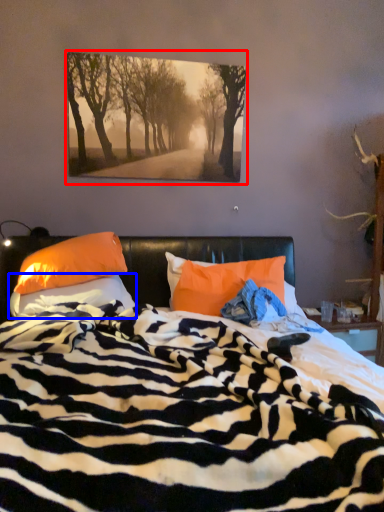
Question: Which object appears closest to the camera in this image, picture frame (highlighted by a red box) or pillow (highlighted by a blue box)?

Choices:
 (A) picture frame
 (B) pillow

Answer: (B)